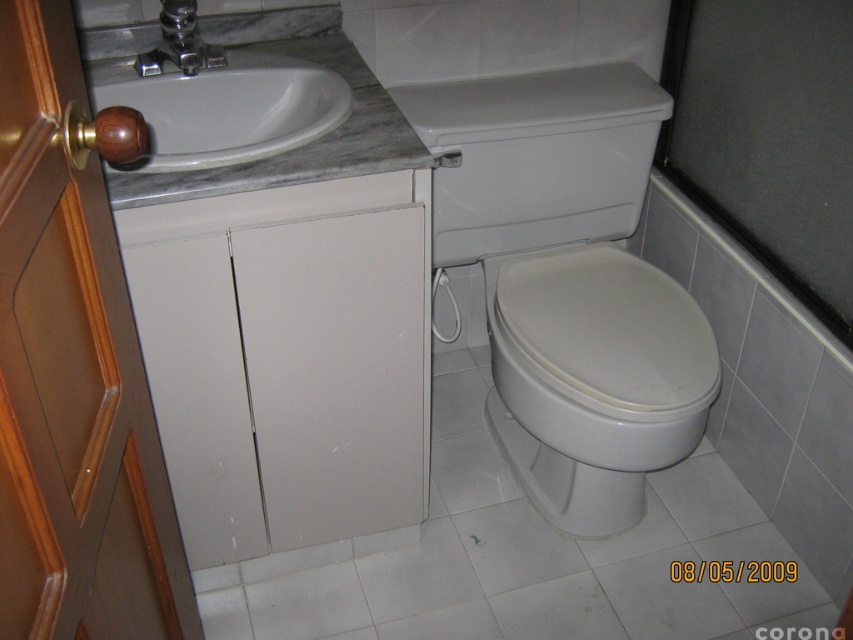
Which of these two, white glossy sink at upper left or silver metallic faucet at upper center, stands shorter?

With less height is silver metallic faucet at upper center.

Can you confirm if white glossy sink at upper left is thinner than silver metallic faucet at upper center?

No.

You are a GUI agent. You are given a task and a screenshot of the screen. Output one action in this format:
    pyautogui.click(x=<x>, y=<y>)
    Task: Click on the white glossy sink at upper left
    This screenshot has height=640, width=853.
    Given the screenshot: What is the action you would take?
    pyautogui.click(x=218, y=97)

Locate an element on the screen. Image resolution: width=853 pixels, height=640 pixels. white glossy sink at upper left is located at coordinates (218, 97).

At what (x,y) coordinates should I click in order to perform the action: click on white glossy toilet at right. Please return your answer as a coordinate pair (x, y). Image resolution: width=853 pixels, height=640 pixels. Looking at the image, I should click on (569, 284).

Between white glossy toilet at right and white glossy sink at upper left, which one has more height?

With more height is white glossy toilet at right.

The width and height of the screenshot is (853, 640). I want to click on white glossy toilet at right, so click(569, 284).

Which is above, white glossy toilet at right or silver metallic faucet at upper center?

silver metallic faucet at upper center is higher up.

Which is more to the right, white glossy toilet at right or silver metallic faucet at upper center?

From the viewer's perspective, white glossy toilet at right appears more on the right side.

Which is behind, point (573, 332) or point (172, 33)?

Positioned behind is point (573, 332).

You are a GUI agent. You are given a task and a screenshot of the screen. Output one action in this format:
    pyautogui.click(x=<x>, y=<y>)
    Task: Click on the white glossy toilet at right
    
    Given the screenshot: What is the action you would take?
    pyautogui.click(x=569, y=284)